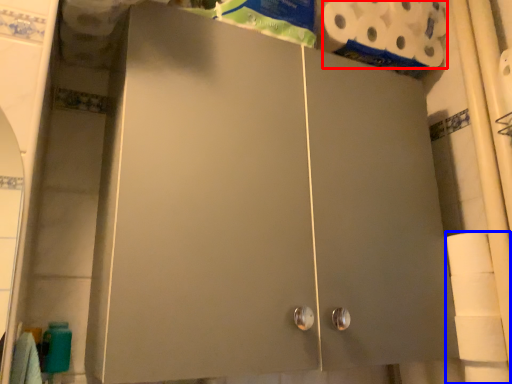
Question: Among these objects, which one is nearest to the camera, toilet paper (highlighted by a red box) or toilet paper (highlighted by a blue box)?

Choices:
 (A) toilet paper
 (B) toilet paper

Answer: (B)